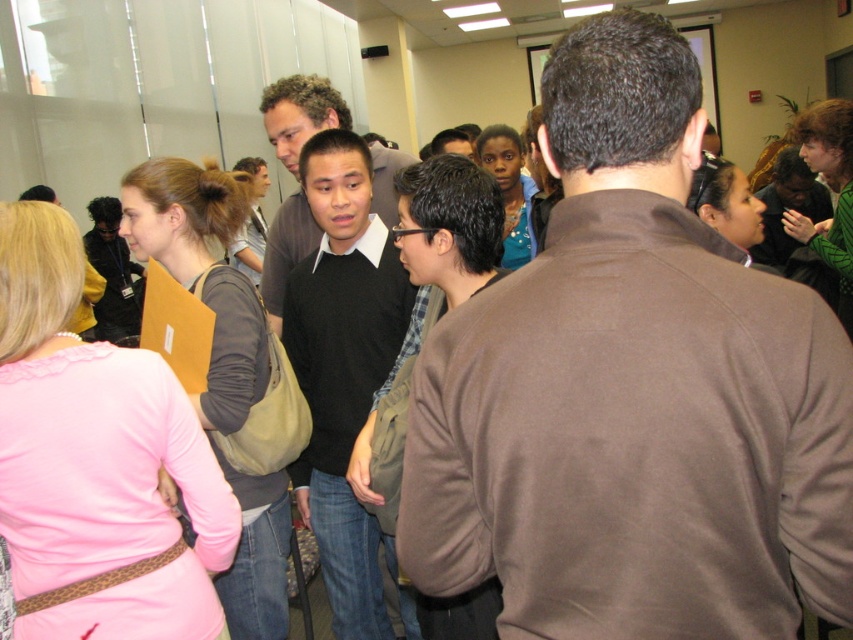
Question: Which object is farther from the camera taking this photo?

Choices:
 (A) black matte sweater at center
 (B) matte beige folder at left
 (C) black sweater at center

Answer: (A)

Question: Estimate the real-world distances between objects in this image. Which object is farther from the black matte sweater at center?

Choices:
 (A) brown sweater at center
 (B) black sweater at center
 (C) matte beige folder at left

Answer: (A)

Question: Does matte beige folder at left have a smaller size compared to black matte sweater at center?

Choices:
 (A) yes
 (B) no

Answer: (B)

Question: Is brown sweater at center positioned at the back of black matte sweater at center?

Choices:
 (A) no
 (B) yes

Answer: (A)

Question: Does matte beige folder at left have a smaller size compared to black matte sweater at center?

Choices:
 (A) no
 (B) yes

Answer: (A)

Question: Based on their relative distances, which object is nearer to the black sweater at center?

Choices:
 (A) matte beige folder at left
 (B) black matte sweater at center

Answer: (A)